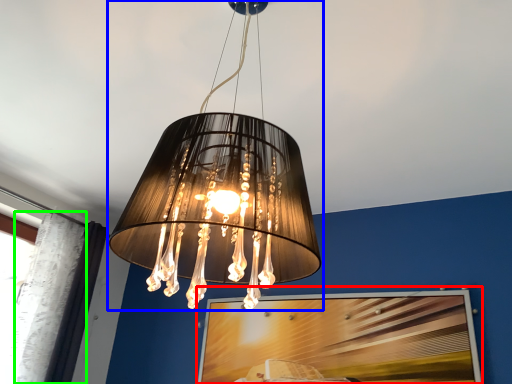
Question: Which object is positioned farthest from picture frame (highlighted by a red box)? Select from lamp (highlighted by a blue box) and curtain (highlighted by a green box).

Choices:
 (A) lamp
 (B) curtain

Answer: (A)